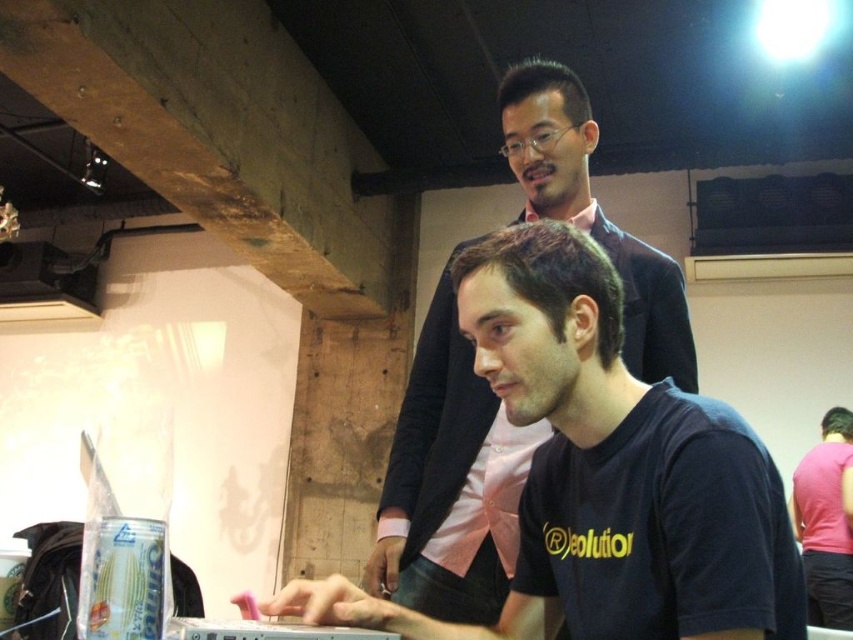
Does black matte shirt at center appear over pink satin shirt at upper center?

Actually, black matte shirt at center is below pink satin shirt at upper center.

Between black matte shirt at center and pink satin shirt at upper center, which one appears on the right side from the viewer's perspective?

Positioned to the right is pink satin shirt at upper center.

Which is behind, point (583, 248) or point (639, 316)?

The point (639, 316) is behind.

The image size is (853, 640). I want to click on black matte shirt at center, so tap(602, 474).

Which of these two, pink satin shirt at upper center or pink fabric shirt at center, stands taller?

pink satin shirt at upper center is taller.

Who is more distant from viewer, [672,285] or [850,435]?

Point [850,435]

You are a GUI agent. You are given a task and a screenshot of the screen. Output one action in this format:
    pyautogui.click(x=<x>, y=<y>)
    Task: Click on the pink satin shirt at upper center
    The height and width of the screenshot is (640, 853).
    Given the screenshot: What is the action you would take?
    pyautogui.click(x=450, y=481)

Can you confirm if black matte shirt at center is bigger than pink fabric shirt at center?

No.

This screenshot has width=853, height=640. I want to click on black matte shirt at center, so click(602, 474).

Locate an element on the screen. black matte shirt at center is located at coordinates (602, 474).